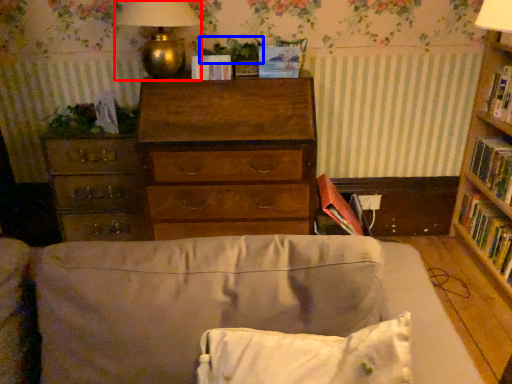
Question: Among these objects, which one is farthest to the camera, table lamp (highlighted by a red box) or plant (highlighted by a blue box)?

Choices:
 (A) table lamp
 (B) plant

Answer: (B)